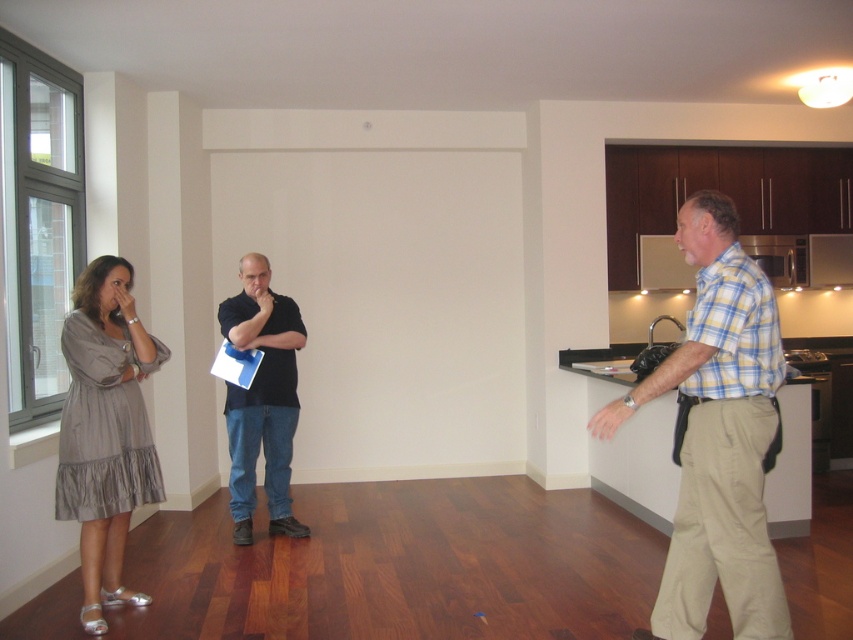
Question: Is the position of yellow plaid shirt at right less distant than that of black matte shirt at center?

Choices:
 (A) yes
 (B) no

Answer: (A)

Question: Which object is farther from the camera taking this photo?

Choices:
 (A) black matte shirt at center
 (B) gray cotton dress at left
 (C) yellow plaid shirt at right
 (D) silvery-grey dress at left

Answer: (A)

Question: Can you confirm if silvery-grey dress at left is wider than black matte shirt at center?

Choices:
 (A) no
 (B) yes

Answer: (A)

Question: Does yellow plaid shirt at right have a smaller size compared to black matte shirt at center?

Choices:
 (A) yes
 (B) no

Answer: (B)

Question: Which object appears farthest from the camera in this image?

Choices:
 (A) gray cotton dress at left
 (B) black matte shirt at center

Answer: (B)

Question: Which object is the farthest from the yellow plaid shirt at right?

Choices:
 (A) black matte shirt at center
 (B) silvery-grey dress at left
 (C) gray cotton dress at left

Answer: (A)